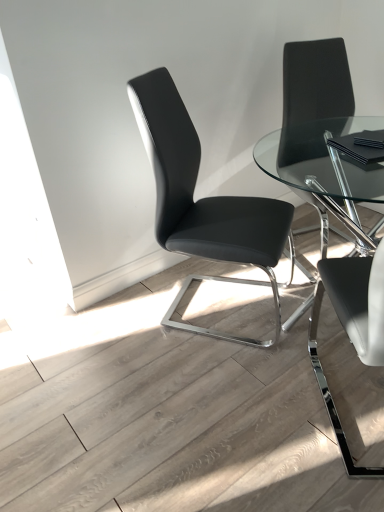
Where is `free space that is in between black leather chair at center, the 3th chair from the right, and black leather chair at right, the second chair in the left-to-right sequence`? This screenshot has height=512, width=384. free space that is in between black leather chair at center, the 3th chair from the right, and black leather chair at right, the second chair in the left-to-right sequence is located at coordinates (249, 378).